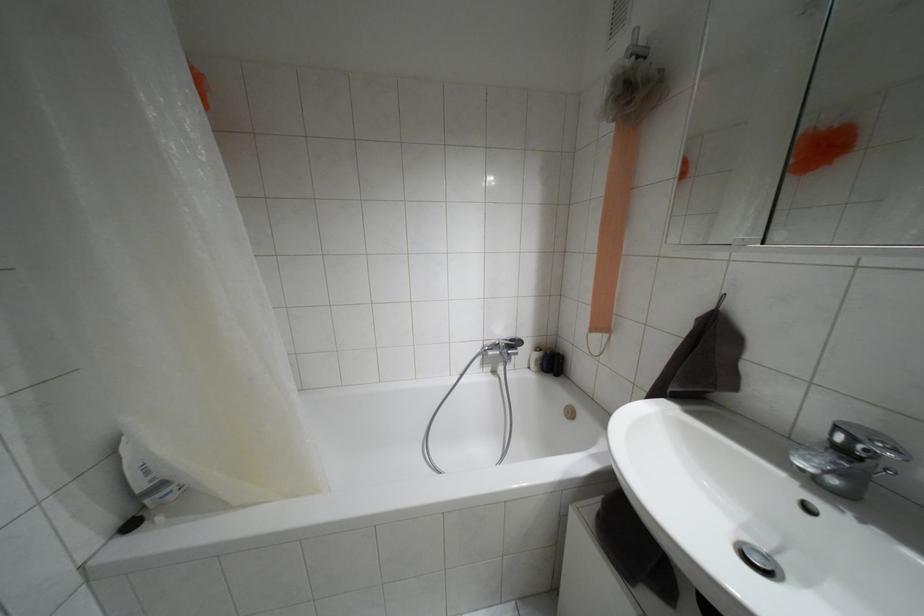
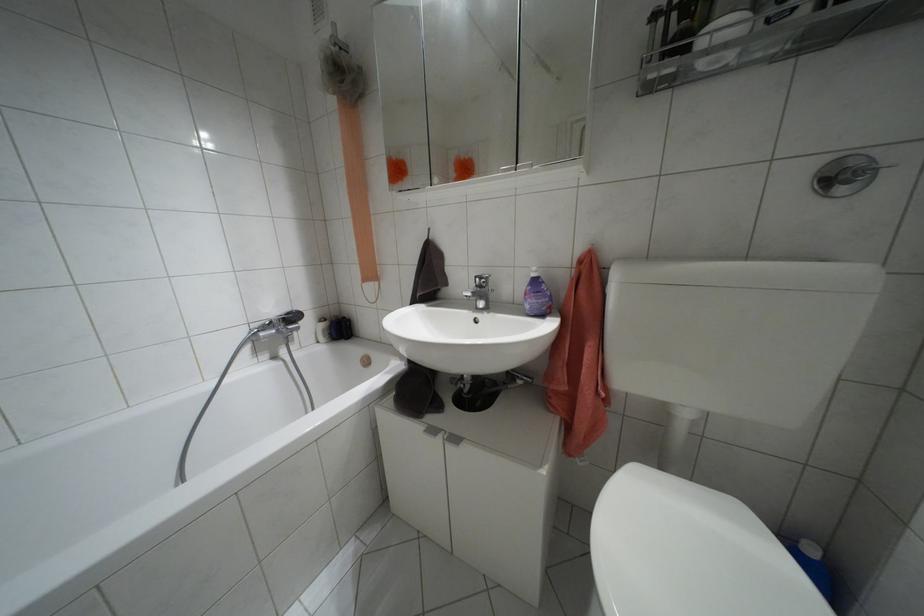
The point at (843, 450) is marked in the first image. Where is the corresponding point in the second image?

(479, 286)